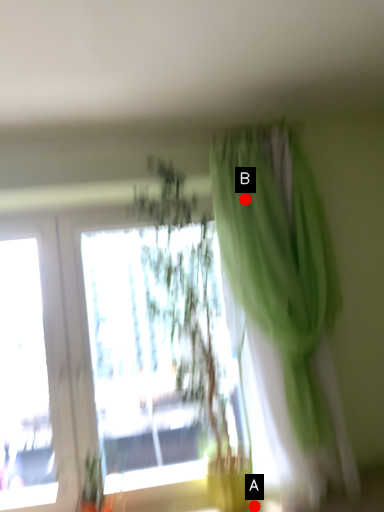
Question: Two points are circled on the image, labeled by A and B beside each circle. Which point is closer to the camera taking this photo?

Choices:
 (A) A is closer
 (B) B is closer

Answer: (B)